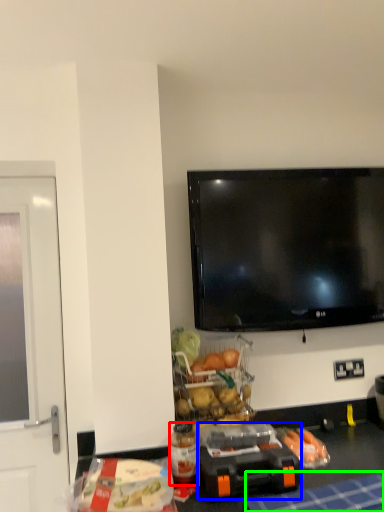
Question: Which object is positioned closest to bottle (highlighted by a red box)? Select from appliance (highlighted by a blue box) and tablecloth (highlighted by a green box).

Choices:
 (A) appliance
 (B) tablecloth

Answer: (A)